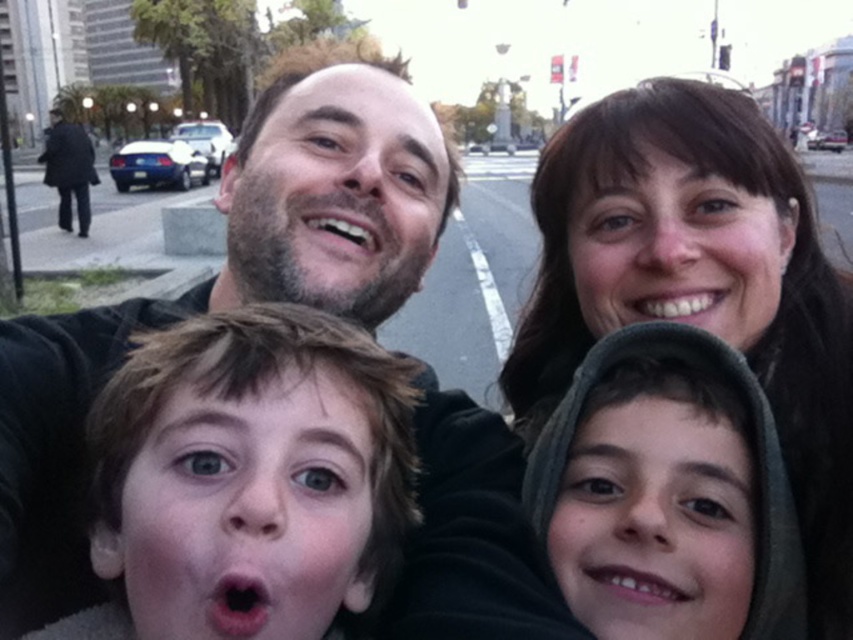
Does dark brown hair at upper center lie behind smooth skin face at upper right?

No, it is not.

Is dark brown hair at upper center closer to the viewer compared to smooth skin face at upper right?

Yes.

Which is behind, point (747, 166) or point (775, 301)?

Positioned behind is point (775, 301).

Where is `dark brown hair at upper center`? The width and height of the screenshot is (853, 640). dark brown hair at upper center is located at coordinates (699, 284).

From the picture: Between dark brown hair at center and smooth skin face at center, which one has more height?

dark brown hair at center

The image size is (853, 640). In order to click on dark brown hair at center in this screenshot , I will do `click(230, 284)`.

Identify the location of dark brown hair at center. This screenshot has width=853, height=640. (230, 284).

How far apart are dark brown hair at center and smooth gray hoodie at lower right?

14.54 inches

Can you confirm if dark brown hair at center is positioned above smooth gray hoodie at lower right?

Correct, dark brown hair at center is located above smooth gray hoodie at lower right.

Is point (439, 168) positioned before point (752, 474)?

No, (439, 168) is further to viewer.

At what (x,y) coordinates should I click in order to perform the action: click on dark brown hair at center. Please return your answer as a coordinate pair (x, y). The width and height of the screenshot is (853, 640). Looking at the image, I should click on (230, 284).